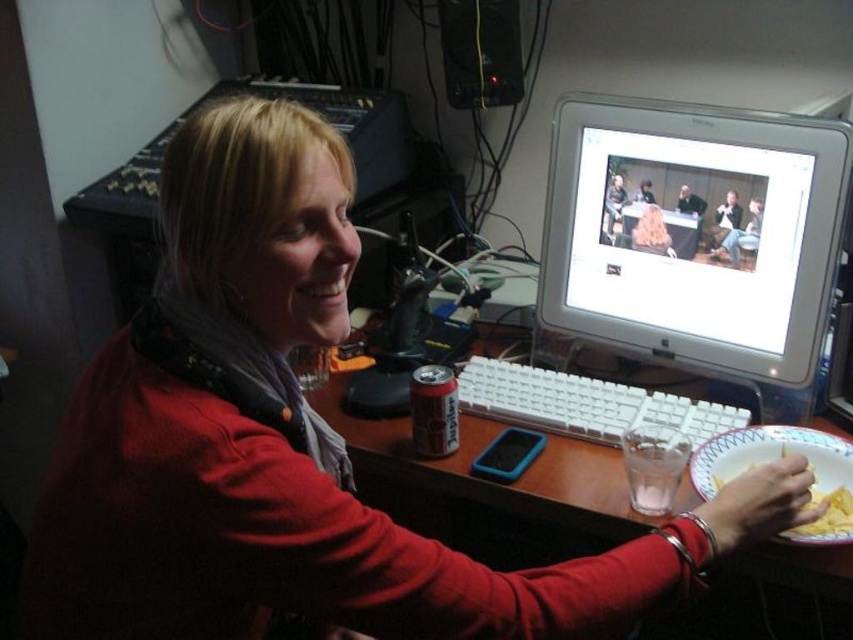
Between point (488, 492) and point (590, 404), which one is positioned behind?

Positioned behind is point (590, 404).

Who is taller, wooden desk at center or white plastic keyboard at center?

wooden desk at center

Is point (547, 467) positioned after point (581, 432)?

No, (547, 467) is in front of (581, 432).

Identify the location of wooden desk at center. The image size is (853, 640). (479, 477).

Can you confirm if white glossy monitor at upper center is taller than white plastic keyboard at center?

Indeed, white glossy monitor at upper center has a greater height compared to white plastic keyboard at center.

Does white glossy monitor at upper center come behind white plastic keyboard at center?

No, it is not.

Between point (589, 125) and point (676, 422), which one is positioned in front?

Positioned in front is point (676, 422).

Find the location of a particular element. The height and width of the screenshot is (640, 853). white glossy monitor at upper center is located at coordinates (694, 232).

Measure the distance between white plastic keyboard at center and white paper plate at lower right.

white plastic keyboard at center is 16.76 centimeters away from white paper plate at lower right.

Is white plastic keyboard at center wider than white paper plate at lower right?

Yes, white plastic keyboard at center is wider than white paper plate at lower right.

Is point (569, 419) in front of point (817, 474)?

That is False.

Locate an element on the screen. The image size is (853, 640). white plastic keyboard at center is located at coordinates (584, 403).